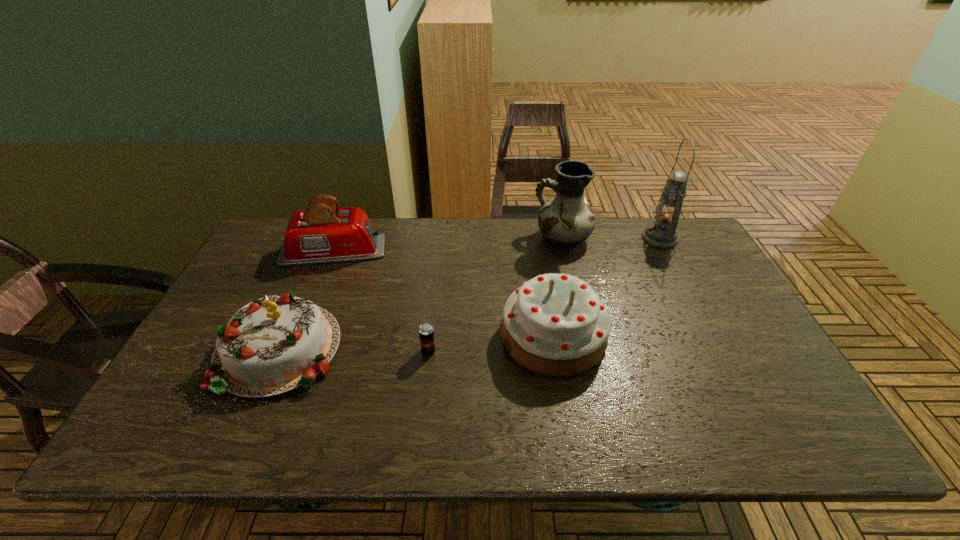
Image resolution: width=960 pixels, height=540 pixels. In order to click on object located in the far left corner section of the desktop in this screenshot , I will do `click(324, 233)`.

The image size is (960, 540). I want to click on object located in the far right corner section of the desktop, so click(x=662, y=233).

Identify the location of free region at the far edge of the desktop. This screenshot has width=960, height=540. (622, 226).

In the image, there is a desktop. At what (x,y) coordinates should I click in order to perform the action: click on free space at the near edge. Please return your answer as a coordinate pair (x, y). The width and height of the screenshot is (960, 540). Looking at the image, I should click on (516, 429).

In the image, there is a desktop. Where is `vacant space at the left edge`? vacant space at the left edge is located at coordinates (219, 312).

Where is `vacant space at the right edge of the desktop`? This screenshot has height=540, width=960. vacant space at the right edge of the desktop is located at coordinates [x=736, y=358].

Locate an element on the screen. The height and width of the screenshot is (540, 960). vacant space at the near right corner of the desktop is located at coordinates (781, 415).

Where is `vacant area that lies between the oil lamp and the vase`? Image resolution: width=960 pixels, height=540 pixels. vacant area that lies between the oil lamp and the vase is located at coordinates (612, 238).

Identify the location of empty space between the tallest object and the right cake. The image size is (960, 540). (607, 287).

Locate an element on the screen. The height and width of the screenshot is (540, 960). vacant area that lies between the vase and the shortest object is located at coordinates (495, 295).